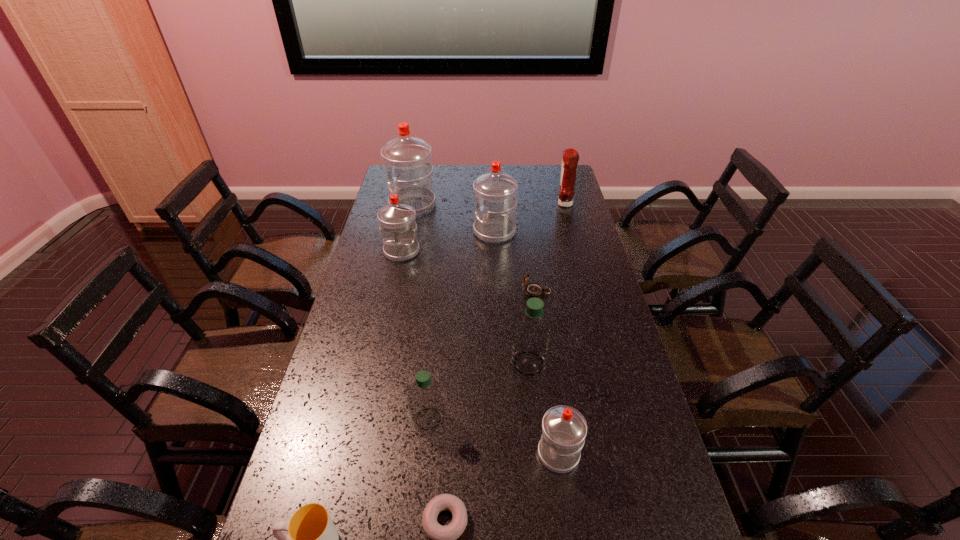
Where is `the farthest water bottle`? This screenshot has height=540, width=960. the farthest water bottle is located at coordinates (407, 157).

Locate an element on the screen. The image size is (960, 540). the tallest object is located at coordinates (407, 157).

Locate an element on the screen. Image resolution: width=960 pixels, height=540 pixels. the second tallest water bottle is located at coordinates coord(495,193).

Identify the location of the third smallest white water bottle. The image size is (960, 540). (495, 193).

Identify the location of the rightmost object. (570, 159).

The height and width of the screenshot is (540, 960). Identify the location of condiment. (570, 159).

You are a GUI agent. You are given a task and a screenshot of the screen. Output one action in this format:
    pyautogui.click(x=<x>, y=<y>)
    Task: Click on the third biggest white water bottle
    
    Given the screenshot: What is the action you would take?
    pyautogui.click(x=397, y=220)

The width and height of the screenshot is (960, 540). I want to click on the bigger green water bottle, so click(x=531, y=335).

I want to click on the third nearest water bottle, so click(x=531, y=335).

At what (x,y) coordinates should I click in order to perform the action: click on the left green water bottle. Please return your answer as a coordinate pair (x, y). Looking at the image, I should click on (425, 398).